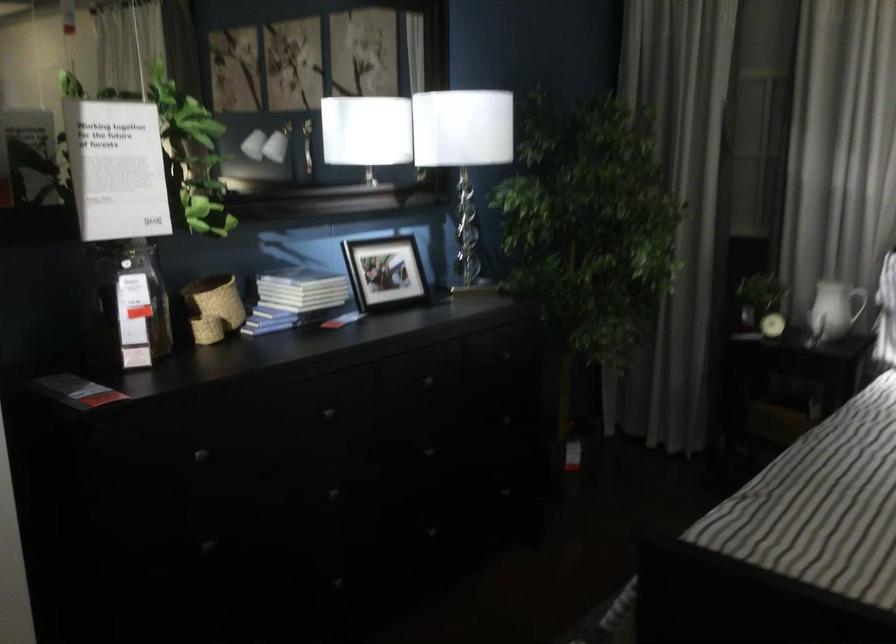
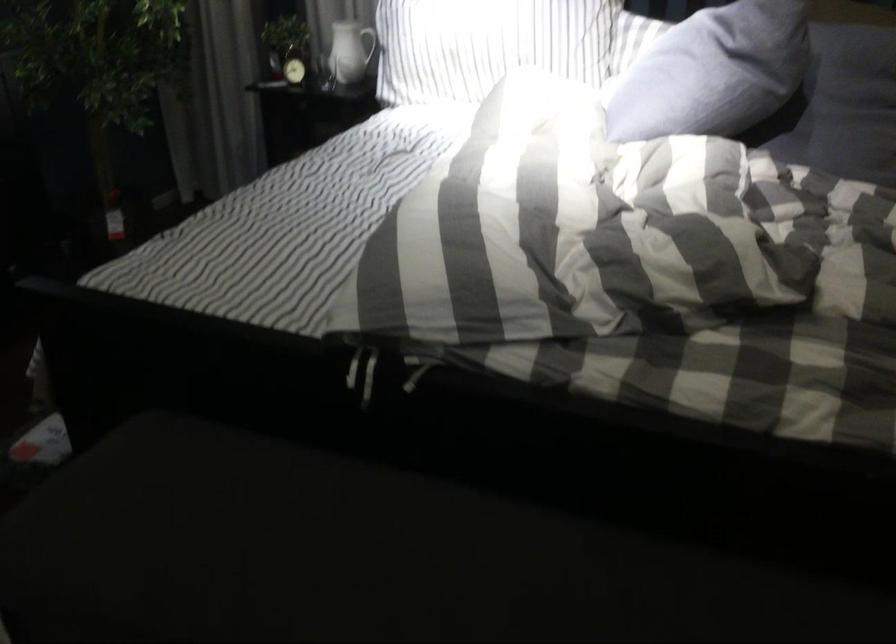
The first image is from the beginning of the video and the second image is from the end. How did the camera likely rotate when shooting the video?

The rotation direction of the camera is right-down.